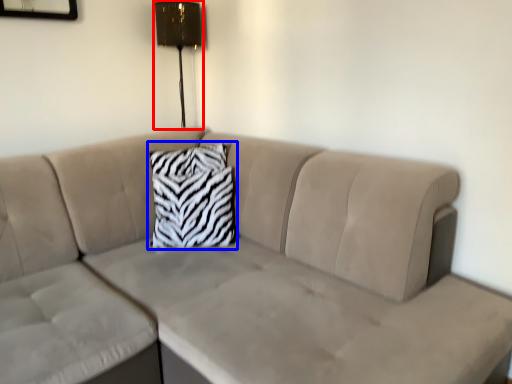
Question: Which object is closer to the camera taking this photo, lamp (highlighted by a red box) or pillow (highlighted by a blue box)?

Choices:
 (A) lamp
 (B) pillow

Answer: (B)